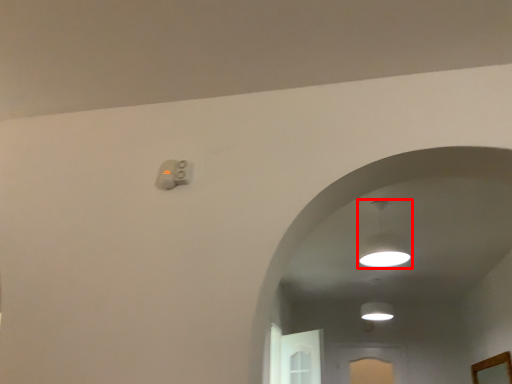
Question: From the image's perspective, considering the relative positions of lamp (annotated by the red box) and mirror in the image provided, where is lamp (annotated by the red box) located with respect to the staircase?

Choices:
 (A) above
 (B) below

Answer: (A)